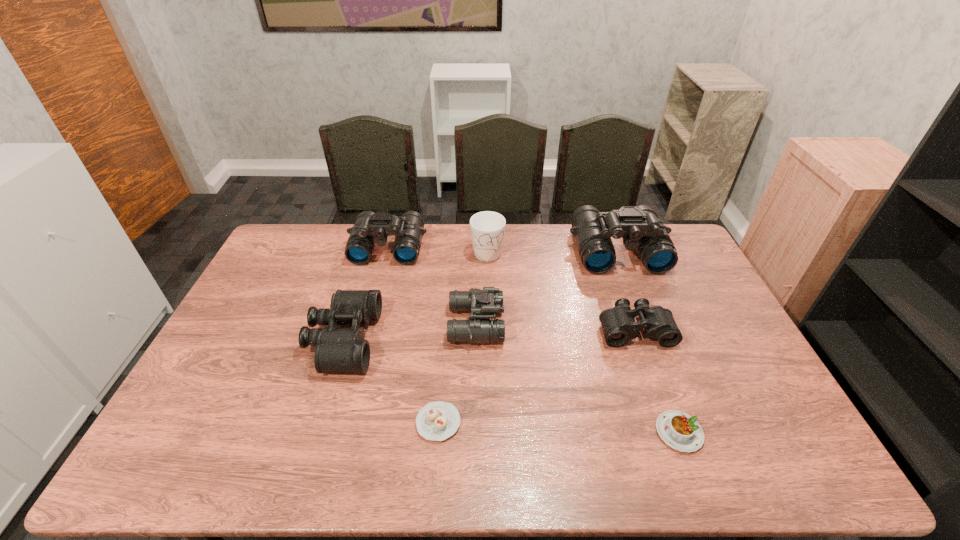
Image resolution: width=960 pixels, height=540 pixels. In order to click on mug that is at the far edge in this screenshot , I will do `click(487, 228)`.

Locate an element on the screen. This screenshot has height=540, width=960. cupcake located at the near edge is located at coordinates coord(437,421).

Where is `pudding located in the near edge section of the desktop`? pudding located in the near edge section of the desktop is located at coordinates (677, 429).

Find the location of a particular element. This screenshot has height=540, width=960. object at the right edge is located at coordinates (641, 229).

Identify the location of object that is at the far right corner. point(641,229).

Locate an element on the screen. This screenshot has height=540, width=960. vacant space at the far edge of the desktop is located at coordinates (517, 225).

Locate an element on the screen. This screenshot has height=540, width=960. blank area at the near edge is located at coordinates (274, 449).

In the image, there is a desktop. Where is `vacant area at the left edge`? vacant area at the left edge is located at coordinates (268, 340).

Identify the location of free space at the right edge. The width and height of the screenshot is (960, 540). (705, 298).

Where is `vacant point at the far left corner`? The image size is (960, 540). vacant point at the far left corner is located at coordinates 304,244.